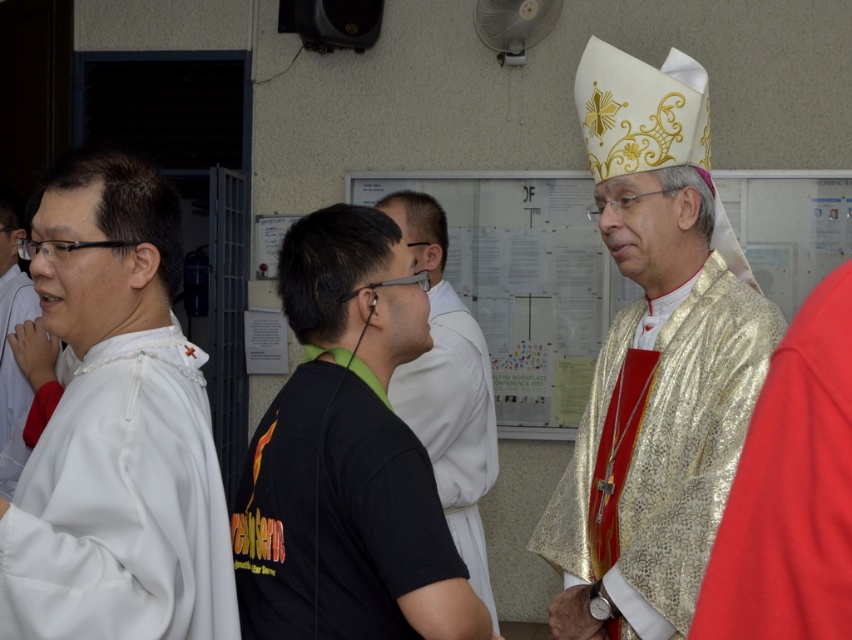
Does white matte robe at left have a lesser width compared to black matte shirt at center?

No, white matte robe at left is not thinner than black matte shirt at center.

From the picture: Between white matte robe at left and black matte shirt at center, which one has more height?

black matte shirt at center is taller.

This screenshot has height=640, width=852. Describe the element at coordinates (116, 428) in the screenshot. I see `white matte robe at left` at that location.

Where is `white matte robe at left`? white matte robe at left is located at coordinates (116, 428).

Does gold shiny robe at right have a lesser height compared to black matte shirt at center?

Yes, gold shiny robe at right is shorter than black matte shirt at center.

Can you confirm if gold shiny robe at right is bigger than black matte shirt at center?

Incorrect, gold shiny robe at right is not larger than black matte shirt at center.

Which is behind, point (767, 342) or point (429, 403)?

Positioned behind is point (429, 403).

In order to click on gold shiny robe at right in this screenshot , I will do (x=694, y=436).

Is black matte t-shirt at center below white matte shirt at left?

Yes.

Which is above, black matte t-shirt at center or white matte shirt at left?

white matte shirt at left is above.

Is point (406, 595) farther from camera compared to point (1, 365)?

No, it is not.

Image resolution: width=852 pixels, height=640 pixels. I want to click on black matte t-shirt at center, so click(346, 456).